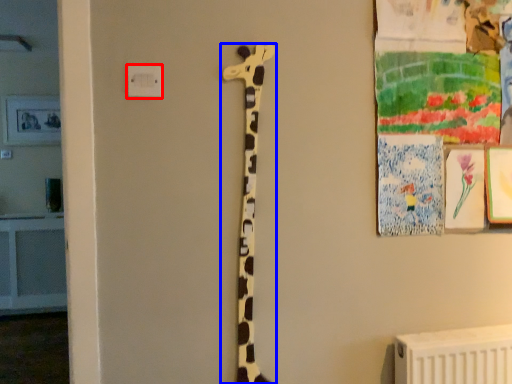
Question: Which of the following is the farthest to the observer, electric outlet (highlighted by a red box) or giraffe (highlighted by a blue box)?

Choices:
 (A) electric outlet
 (B) giraffe

Answer: (B)